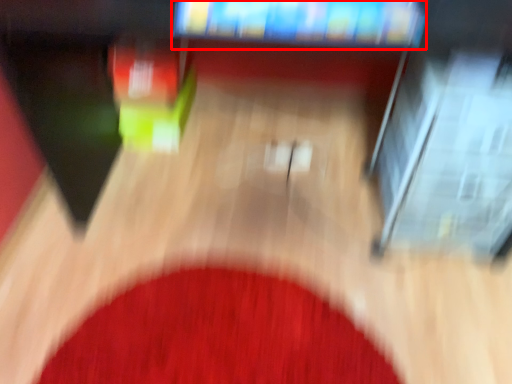
Question: From the image's perspective, where is television (annotated by the red box) located in relation to mat in the image?

Choices:
 (A) above
 (B) below

Answer: (A)